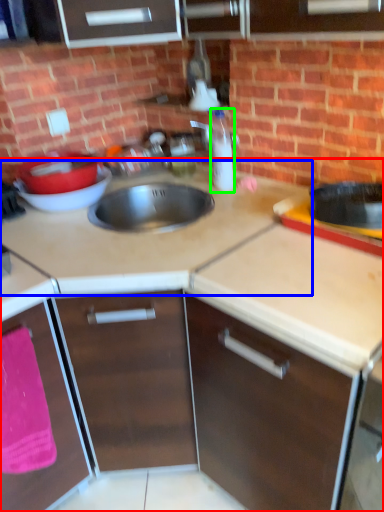
Question: Which object is positioned closest to countertop (highlighted by a red box)? Select from countertop (highlighted by a blue box) and bottle (highlighted by a green box).

Choices:
 (A) countertop
 (B) bottle

Answer: (A)